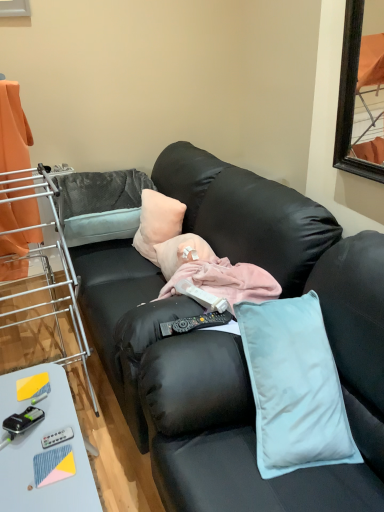
In order to face black plastic remote control at lower left, the 1th equipment in the left-to-right sequence, should I rotate leftwards or rightwards?

Turn left approximately 21.801 degrees to face it.

Image resolution: width=384 pixels, height=512 pixels. Describe the element at coordinates (157, 222) in the screenshot. I see `peachy soft pillow at center` at that location.

Describe the element at coordinates (43, 450) in the screenshot. I see `light blue plastic table at lower left` at that location.

At what (x,y) coordinates should I click in order to perform the action: click on black leather couch at center. Please return your answer as a coordinate pair (x, y). The image size is (384, 512). Looking at the image, I should click on (237, 341).

At what (x,y) coordinates should I click in order to perform the action: click on metal/brushed metal laundry rack at left. Please return your answer as a coordinate pair (x, y). This screenshot has height=512, width=384. Looking at the image, I should click on (40, 285).

Describe the element at coordinates (13, 130) in the screenshot. I see `orange fabric curtain at left` at that location.

This screenshot has height=512, width=384. In order to click on black plastic remote control at center in this screenshot , I will do `click(194, 323)`.

This screenshot has height=512, width=384. I want to click on the 1st equipment directly beneath the orange fabric curtain at left (from a real-world perspective), so click(x=23, y=420).

Considering the relative sizes of orange fabric curtain at left and black plastic remote control at lower left, which ranks as the second equipment in right-to-left order, in the image provided, is orange fabric curtain at left smaller than black plastic remote control at lower left, which ranks as the second equipment in right-to-left order,?

Actually, orange fabric curtain at left might be larger than black plastic remote control at lower left, which ranks as the second equipment in right-to-left order.

From the picture: From a real-world perspective, which object rests below the other?

From a 3D spatial view, black plastic remote control at lower left, which ranks as the second equipment in right-to-left order, is below.

Is orange fabric curtain at left far from black plastic remote control at lower left, the 1th equipment in the left-to-right sequence?

No, there isn't a large distance between orange fabric curtain at left and black plastic remote control at lower left, the 1th equipment in the left-to-right sequence.

From the picture: How much distance is there between peachy soft pillow at center and metal/brushed metal laundry rack at left?

peachy soft pillow at center and metal/brushed metal laundry rack at left are 21.46 inches apart from each other.

Is peachy soft pillow at center wider or thinner than metal/brushed metal laundry rack at left?

peachy soft pillow at center is thinner than metal/brushed metal laundry rack at left.

From a real-world perspective, relative to metal/brushed metal laundry rack at left, is peachy soft pillow at center vertically above or below?

peachy soft pillow at center is situated lower than metal/brushed metal laundry rack at left in the real world.

Does peachy soft pillow at center have a greater height compared to metal/brushed metal laundry rack at left?

No, peachy soft pillow at center is not taller than metal/brushed metal laundry rack at left.

Is black leather couch at center facing away from light blue plastic table at lower left?

No, black leather couch at center is not facing away from light blue plastic table at lower left.

From the image's perspective, is black leather couch at center located above or below light blue plastic table at lower left?

Based on their image positions, black leather couch at center is located above light blue plastic table at lower left.

Which of these two, metallic silver remote control at lower left, the first equipment viewed from the right, or peachy soft pillow at center, is bigger?

peachy soft pillow at center.

Is metallic silver remote control at lower left, the second equipment when ordered from left to right, spatially inside peachy soft pillow at center, or outside of it?

metallic silver remote control at lower left, the second equipment when ordered from left to right, is not enclosed by peachy soft pillow at center.

Considering the sizes of metallic silver remote control at lower left, the second equipment when ordered from left to right, and peachy soft pillow at center in the image, is metallic silver remote control at lower left, the second equipment when ordered from left to right, taller or shorter than peachy soft pillow at center?

Clearly, metallic silver remote control at lower left, the second equipment when ordered from left to right, is shorter compared to peachy soft pillow at center.

From a real-world perspective, which object stands above the other?

peachy soft pillow at center, from a real-world perspective.

From the image's perspective, would you say metallic silver remote control at lower left, the first equipment viewed from the right, is positioned over orange fabric curtain at left?

No, from the image's perspective, metallic silver remote control at lower left, the first equipment viewed from the right, is not over orange fabric curtain at left.

Is metallic silver remote control at lower left, the second equipment when ordered from left to right, wider or thinner than orange fabric curtain at left?

Considering their sizes, metallic silver remote control at lower left, the second equipment when ordered from left to right, looks slimmer than orange fabric curtain at left.

Between point (63, 439) and point (16, 275), which one is positioned in front?

The point (63, 439) is closer.

Is metallic silver remote control at lower left, the second equipment when ordered from left to right, positioned beyond the bounds of orange fabric curtain at left?

Absolutely, metallic silver remote control at lower left, the second equipment when ordered from left to right, is external to orange fabric curtain at left.

Is point (47, 405) farther from camera compared to point (225, 250)?

That is False.

Could black leather couch at center be considered to be inside light blue plastic table at lower left?

No.

Between light blue plastic table at lower left and black leather couch at center, which one has larger width?

black leather couch at center.

How different are the orientations of light blue plastic table at lower left and black leather couch at center in degrees?

There is a 1.3-degree angle between the facing directions of light blue plastic table at lower left and black leather couch at center.

Based on their sizes in the image, would you say black plastic remote control at lower left, which ranks as the second equipment in right-to-left order, is bigger or smaller than orange fabric curtain at left?

black plastic remote control at lower left, which ranks as the second equipment in right-to-left order, is smaller than orange fabric curtain at left.

Is black plastic remote control at lower left, the 1th equipment in the left-to-right sequence, aimed at orange fabric curtain at left?

No, black plastic remote control at lower left, the 1th equipment in the left-to-right sequence, does not turn towards orange fabric curtain at left.

From the image's perspective, is black plastic remote control at lower left, which ranks as the second equipment in right-to-left order, located above orange fabric curtain at left?

Incorrect, from the image's perspective, black plastic remote control at lower left, which ranks as the second equipment in right-to-left order, is lower than orange fabric curtain at left.

This screenshot has height=512, width=384. Identify the location of the 1st equipment to the right of the orange fabric curtain at left, counting from the anchor's position. (23, 420).

The height and width of the screenshot is (512, 384). Find the location of `pillow beneath the metal/brushed metal laundry rack at left (from a real-world perspective)`. pillow beneath the metal/brushed metal laundry rack at left (from a real-world perspective) is located at coordinates (157, 222).

Considering their positions, is black plastic remote control at center positioned further to peachy soft pillow at center than light blue plastic table at lower left?

light blue plastic table at lower left.

Considering their positions, is black plastic remote control at center positioned further to light blue plastic table at lower left than black plastic remote control at lower left, which ranks as the second equipment in right-to-left order?

Based on the image, black plastic remote control at center appears to be further to light blue plastic table at lower left.

Consider the image. Looking at the image, which one is located further to black plastic remote control at lower left, the 1th equipment in the left-to-right sequence, metal/brushed metal laundry rack at left or light blue plastic table at lower left?

metal/brushed metal laundry rack at left lies further to black plastic remote control at lower left, the 1th equipment in the left-to-right sequence, than the other object.

Estimate the real-world distances between objects in this image. Which object is closer to black plastic remote control at center, metal/brushed metal laundry rack at left or black leather couch at center?

black leather couch at center is positioned closer to the anchor black plastic remote control at center.

Looking at this image, which object lies nearer to the anchor point black plastic remote control at lower left, the 1th equipment in the left-to-right sequence, metal/brushed metal laundry rack at left or black plastic remote control at center?

Among the two, black plastic remote control at center is located nearer to black plastic remote control at lower left, the 1th equipment in the left-to-right sequence.

Estimate the real-world distances between objects in this image. Which object is further from metallic silver remote control at lower left, the first equipment viewed from the right, black leather couch at center or peachy soft pillow at center?

peachy soft pillow at center is positioned further to the anchor metallic silver remote control at lower left, the first equipment viewed from the right.

When comparing their distances from orange fabric curtain at left, does peachy soft pillow at center or metal/brushed metal laundry rack at left seem further?

peachy soft pillow at center lies further to orange fabric curtain at left than the other object.

From the image, which object appears to be farther from metal/brushed metal laundry rack at left, metallic silver remote control at lower left, the second equipment when ordered from left to right, or black leather couch at center?

metallic silver remote control at lower left, the second equipment when ordered from left to right, lies further to metal/brushed metal laundry rack at left than the other object.

Where is `studio couch between orange fabric curtain at left and black plastic remote control at center in the horizontal direction`? This screenshot has height=512, width=384. studio couch between orange fabric curtain at left and black plastic remote control at center in the horizontal direction is located at coordinates (237, 341).

This screenshot has width=384, height=512. In order to click on remote control between black leather couch at center and light blue plastic table at lower left from top to bottom in this screenshot , I will do `click(194, 323)`.

I want to click on remote control located between metal/brushed metal laundry rack at left and peachy soft pillow at center in the depth direction, so click(x=194, y=323).

The image size is (384, 512). Find the location of `studio couch situated between metal/brushed metal laundry rack at left and black plastic remote control at center from left to right`. studio couch situated between metal/brushed metal laundry rack at left and black plastic remote control at center from left to right is located at coordinates (237, 341).